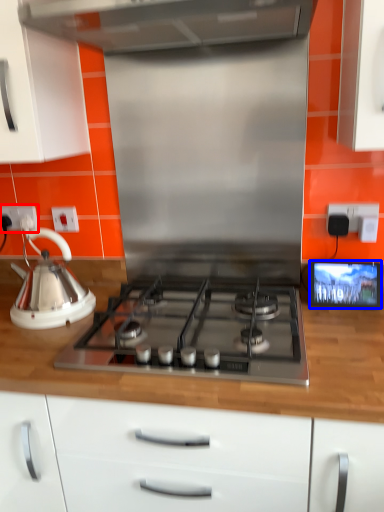
Question: Which object is closer to the camera taking this photo, electric outlet (highlighted by a red box) or screen (highlighted by a blue box)?

Choices:
 (A) electric outlet
 (B) screen

Answer: (B)